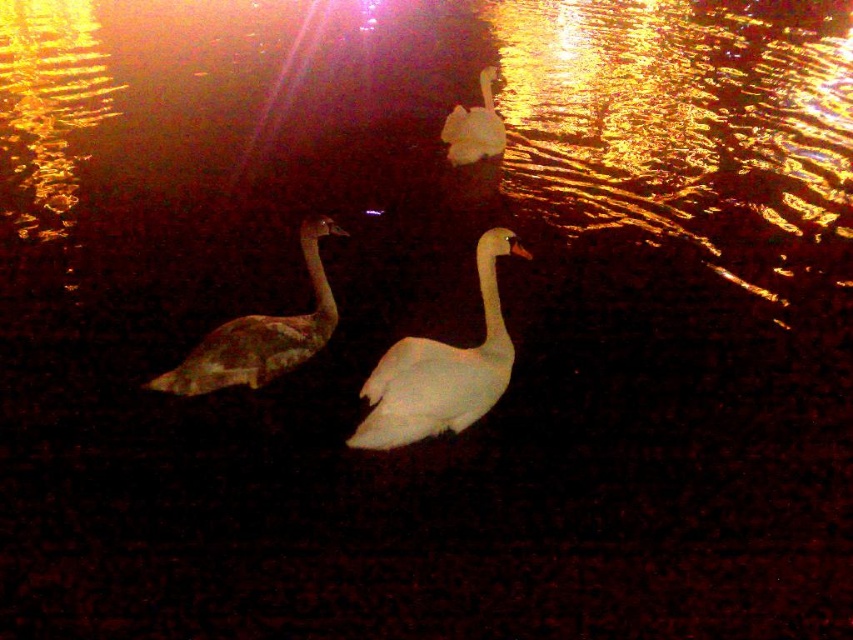
Based on the coordinates provided, which object is located at point (x=440, y=369)?

The point (x=440, y=369) corresponds to the white glossy swan at center.

In the nighttime scene with a warm reddish orange hue, you see a brown speckled goose at left and a white glossy swan at upper center. Which of these two birds is larger?

→ The white glossy swan at upper center is larger than the brown speckled goose at left.